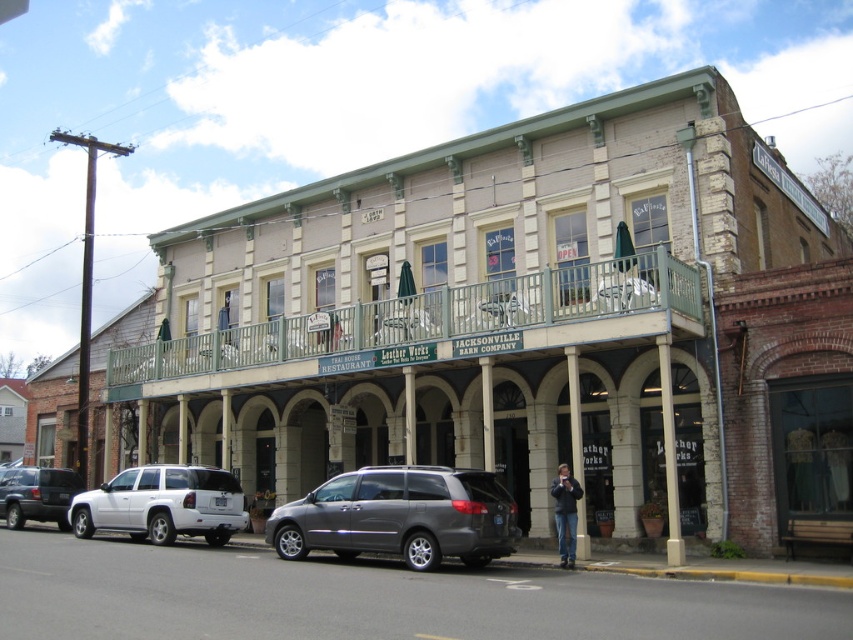
You are standing on the sidewalk in front of the two story building and see the white matte suv at lower left and the matte black suv at lower left. Which SUV is closer to you?

The white matte suv at lower left is closer to the viewer than the matte black suv at lower left.

You are standing at the center of the image and want to move to the white matte suv at lower left. In which direction should you walk?

You should walk towards the lower left direction to reach the white matte suv at lower left.

You are a delivery driver approaching the building and need to park your white matte suv at lower left near the Jacksonville Barn Company sign. The green metal railing at upper center is blocking the view of the sign. Can you see the sign while parked there?

The green metal railing at upper center is to the right of the white matte suv at lower left, so when parked there, the suv driver would have an unobstructed view of the Jacksonville Barn Company sign as the railing is positioned to the right side.